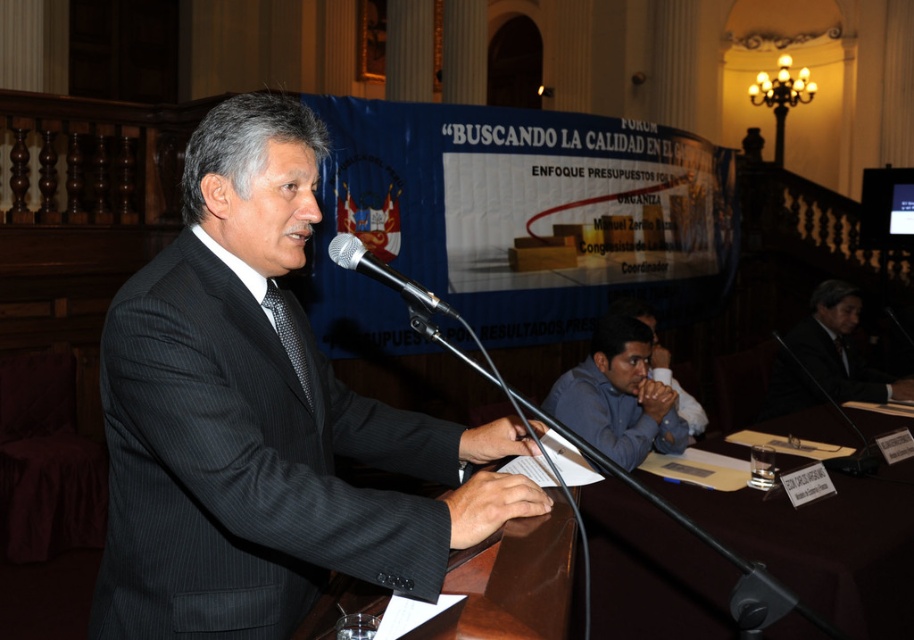
In the scene shown: You are a photographer positioned to the right of the scene. You want to take a photo that includes both the brown wooden table at center and the dark gray suit at center. Which object should you move closer to in order to frame both subjects properly?

To frame both the brown wooden table at center and the dark gray suit at center properly, you should move closer to the brown wooden table at center since it is positioned to the left of the dark gray suit at center, bringing both into the same frame.

You are a photographer positioned at the back of the room. You want to take a photo of the black dotted tie at center without the brown wooden table at center blocking it. Is this possible?

The black dotted tie at center is behind the brown wooden table at center, so it would be blocked by the table. You cannot take a photo of the black dotted tie at center without the brown wooden table at center blocking it.

You are a photographer at the event and need to position yourself so that the brown wooden table at center and the black dotted tie at center are both visible in your shot. Based on their positions, which object should you prioritize framing closer to the right side of the camera frame?

The brown wooden table at center is positioned on the right side of black dotted tie at center, so you should prioritize framing the brown wooden table at center closer to the right side of the camera frame.